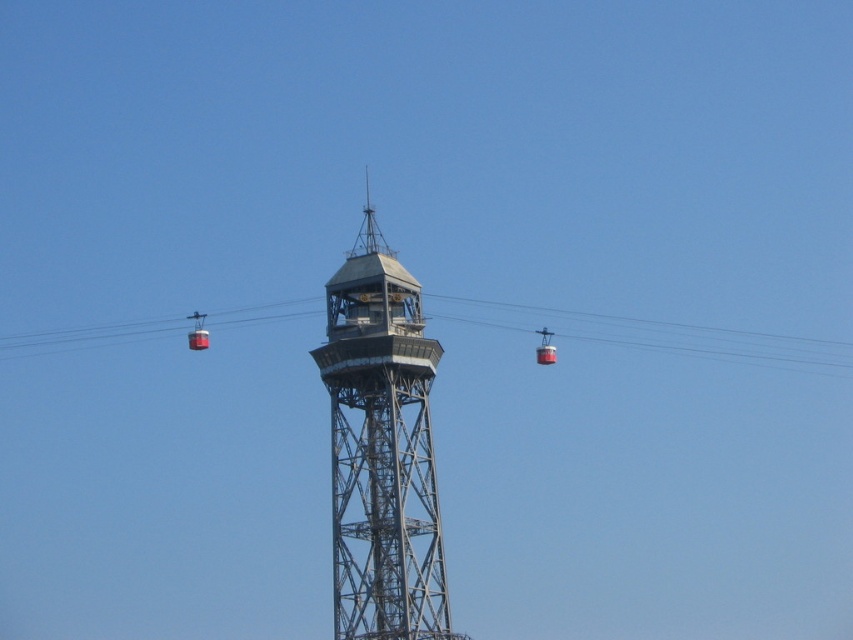
You are a visitor planning to take a photo of the metallic gray tower at center and the metallic cable car at center from a distance. Which object will appear narrower in your photo?

The metallic gray tower at center will appear narrower in your photo since it has a lesser width compared to the metallic cable car at center.

You are standing at the origin point of the coordinate system in the image. The metallic gray tower at center is located at point 0.703, 0.448. If you want to walk directly towards the tower, which direction should you head?

Since the metallic gray tower at center is located at coordinates 0.703 on the x axis and 0.448 on the y axis, you should move towards the right and slightly upwards to reach it.

You are a visitor standing at the base of the metallic gray tower at center and want to take a photo of the metallic cable car at center as it passes by. Which object will appear larger in your photo?

The metallic gray tower at center will appear larger in the photo because it is bigger than the metallic cable car at center.